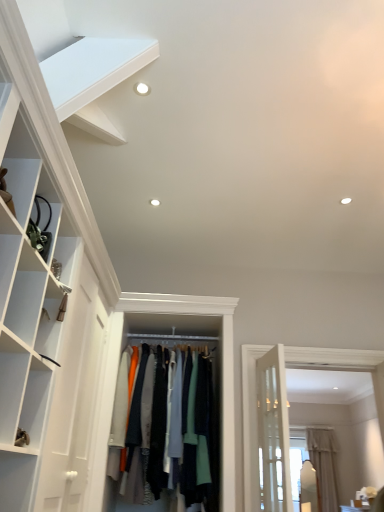
Question: Is white matte shelf at upper left inside the boundaries of beige fabric curtain at right, or outside?

Choices:
 (A) inside
 (B) outside

Answer: (B)

Question: Is white matte shelf at upper left wider or thinner than beige fabric curtain at right?

Choices:
 (A) thin
 (B) wide

Answer: (A)

Question: Estimate the real-world distances between objects in this image. Which object is farther from the knit fabric sweater at center?

Choices:
 (A) beige fabric curtain at right
 (B) white matte shelf at upper left

Answer: (A)

Question: Which object is the farthest from the white matte shelf at upper left?

Choices:
 (A) beige fabric curtain at right
 (B) knit fabric sweater at center

Answer: (A)